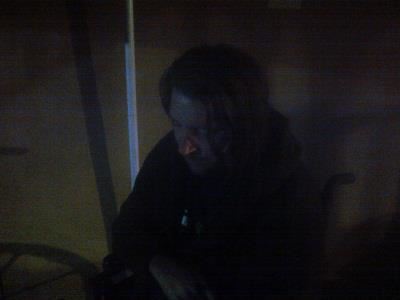
Image resolution: width=400 pixels, height=300 pixels. Identify the location of wheelchair handle. (336, 180).